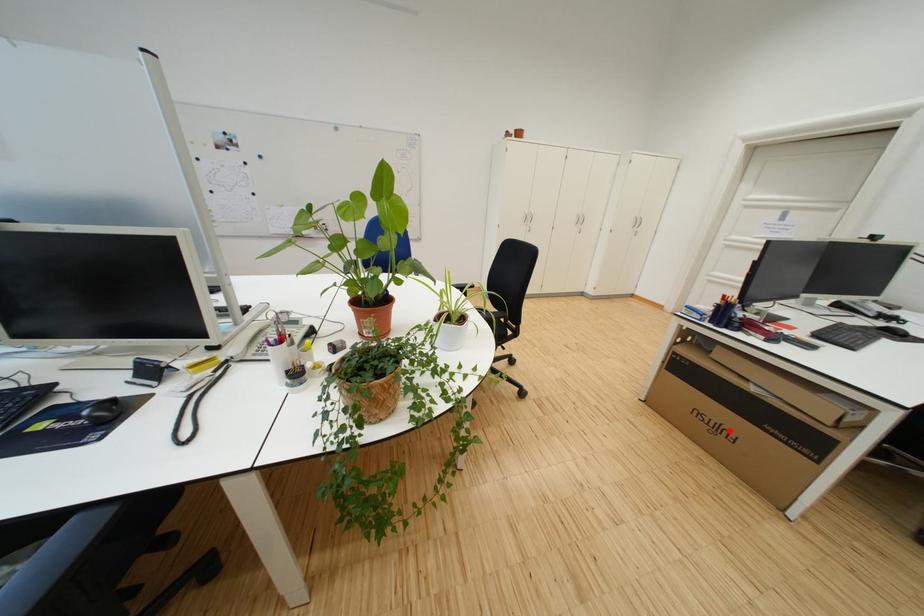
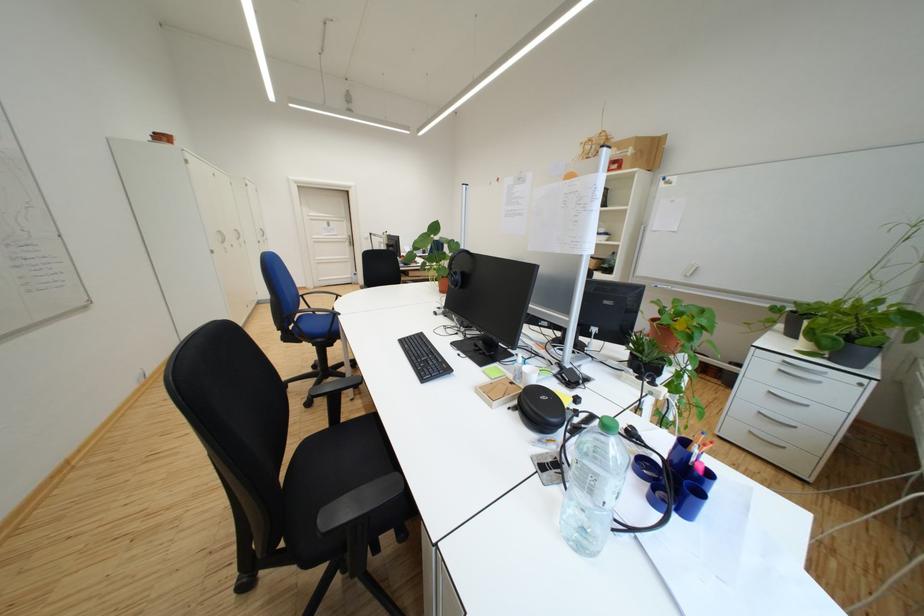
Question: I am providing you with two images of the same scene from different viewpoints. A red point is marked on the first image. Can you still see the location of the red point in image 2?

Choices:
 (A) Yes
 (B) No

Answer: (B)